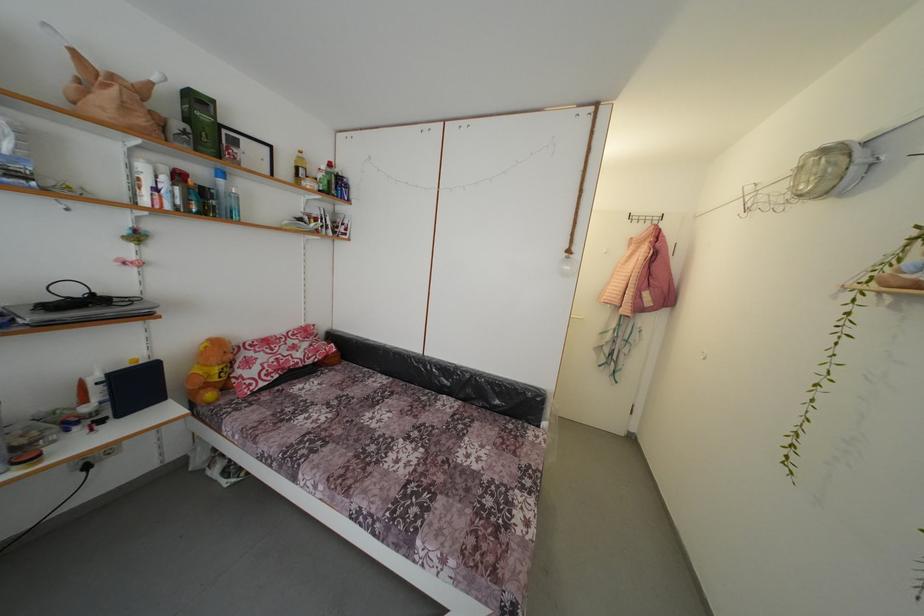
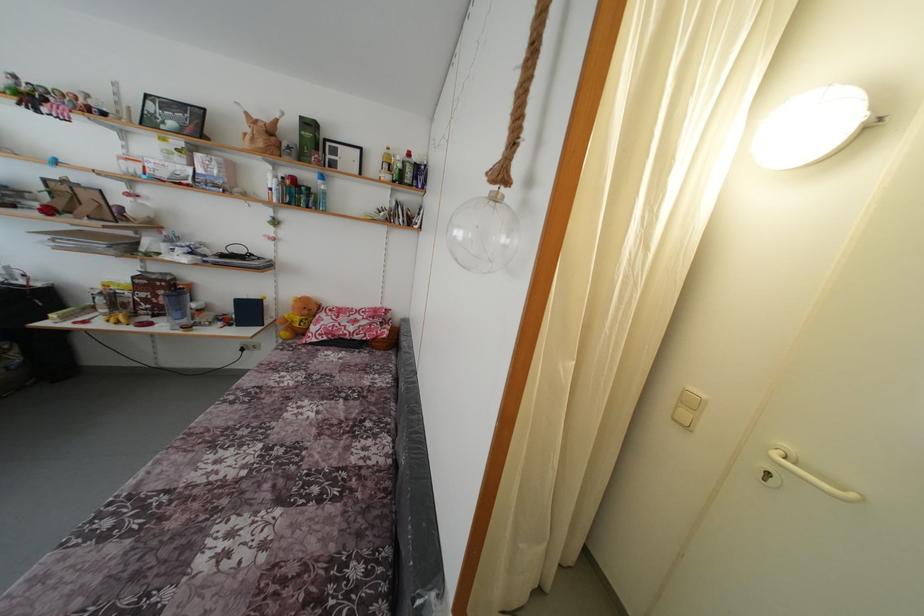
Where in the second image is the point corresponding to (225,187) from the first image?

(324, 188)